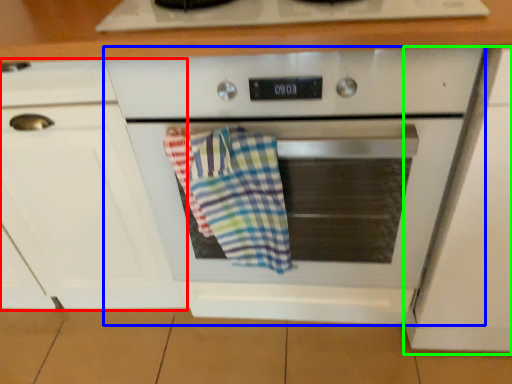
Question: Which object is the farthest from cabinetry (highlighted by a red box)? Choose among these: oven (highlighted by a blue box) or cabinetry (highlighted by a green box).

Choices:
 (A) oven
 (B) cabinetry

Answer: (B)